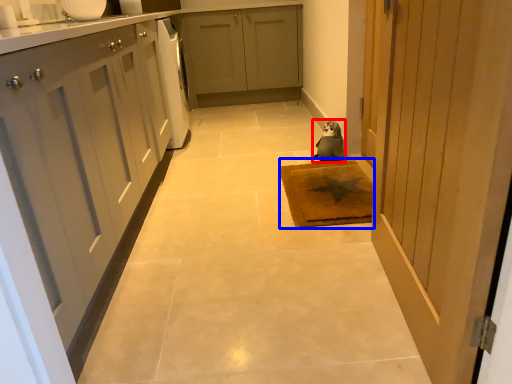
Question: Which of the following is the closest to the observer, animal (highlighted by a red box) or mat (highlighted by a blue box)?

Choices:
 (A) animal
 (B) mat

Answer: (B)